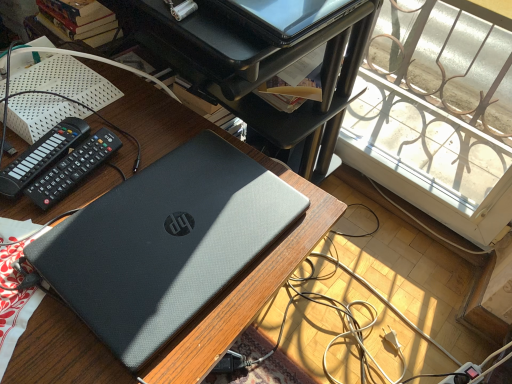
Where is `empty space that is ontop of matte black laptop at center`? empty space that is ontop of matte black laptop at center is located at coordinates (125, 209).